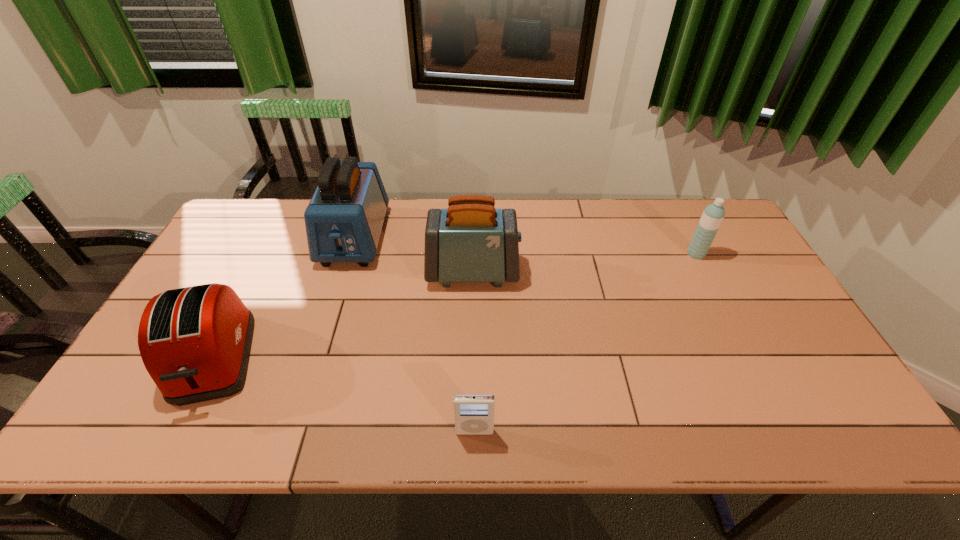
Find the location of `blank space located on the right of the fourth farthest object`. blank space located on the right of the fourth farthest object is located at coordinates (357, 360).

Where is `object situated at the far edge`? Image resolution: width=960 pixels, height=540 pixels. object situated at the far edge is located at coordinates (344, 219).

At what (x,y) coordinates should I click in order to perform the action: click on toaster positioned at the near edge. Please return your answer as a coordinate pair (x, y). The height and width of the screenshot is (540, 960). Looking at the image, I should click on (195, 342).

At what (x,y) coordinates should I click in order to perform the action: click on iPod situated at the near edge. Please return your answer as a coordinate pair (x, y). The image size is (960, 540). Looking at the image, I should click on (474, 413).

What are the coordinates of `object at the left edge` in the screenshot? It's located at (195, 342).

Where is `object at the right edge`? object at the right edge is located at coordinates (713, 215).

Find the location of a particular element. object that is at the near left corner is located at coordinates (195, 342).

Where is `free region at the far edge`? The width and height of the screenshot is (960, 540). free region at the far edge is located at coordinates (420, 200).

Where is `free space at the near edge`? The height and width of the screenshot is (540, 960). free space at the near edge is located at coordinates (535, 426).

I want to click on vacant area at the left edge, so click(x=232, y=267).